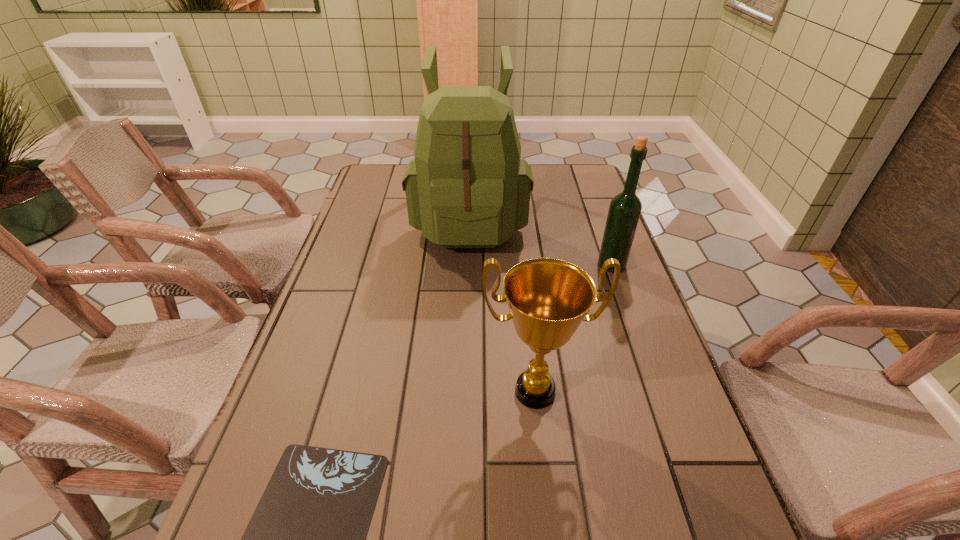
Where is `the tallest object`? The width and height of the screenshot is (960, 540). the tallest object is located at coordinates (467, 187).

In order to click on the rightmost object in this screenshot , I will do `click(625, 208)`.

The height and width of the screenshot is (540, 960). What are the coordinates of `award` in the screenshot? It's located at (548, 299).

At what (x,y) coordinates should I click in order to perform the action: click on free point located 0.220m on the front pocket of the tallest object. Please return your answer as a coordinate pair (x, y). This screenshot has width=960, height=540. Looking at the image, I should click on (467, 320).

The width and height of the screenshot is (960, 540). Find the location of `vacant space located 0.080m on the left of the rightmost object`. vacant space located 0.080m on the left of the rightmost object is located at coordinates (568, 265).

At what (x,y) coordinates should I click in order to perform the action: click on vacant space located 0.110m on the front view with handles of the award. Please return your answer as a coordinate pair (x, y). The height and width of the screenshot is (540, 960). Looking at the image, I should click on (545, 484).

The image size is (960, 540). Identify the location of object that is at the far edge. (467, 187).

The height and width of the screenshot is (540, 960). Identify the location of object that is at the right edge. (625, 208).

Locate an element on the screen. vacant space at the far edge of the desktop is located at coordinates (544, 182).

Image resolution: width=960 pixels, height=540 pixels. What are the coordinates of `vacant position at the left edge of the desktop` in the screenshot? It's located at (348, 277).